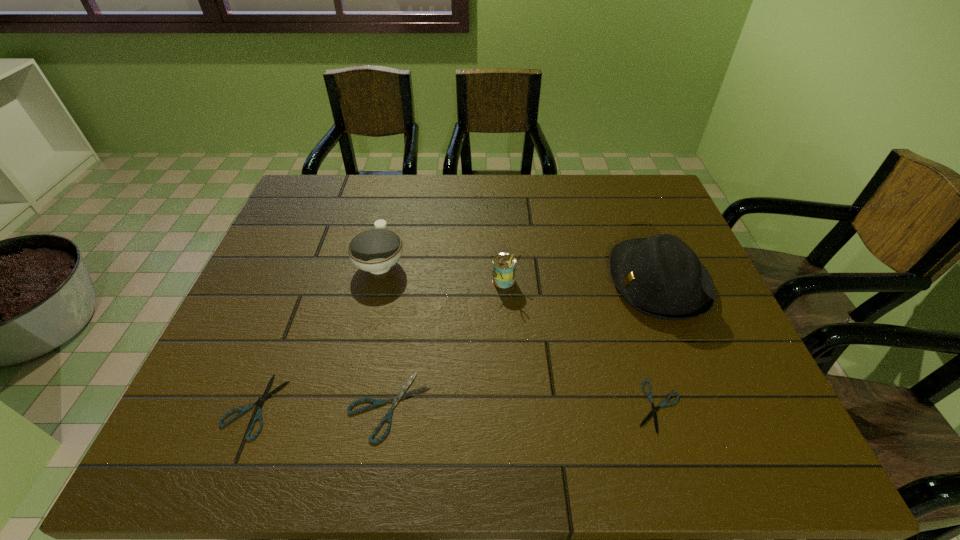
If we want them evenly spaced by inserting an extra shears among them, please locate a free spot for this new shears. Please provide its 2D coordinates. Your answer should be formatted as a tuple, i.e. [(x, y)], where the tuple contains the x and y coordinates of a point satisfying the conditions above.

[(523, 406)]